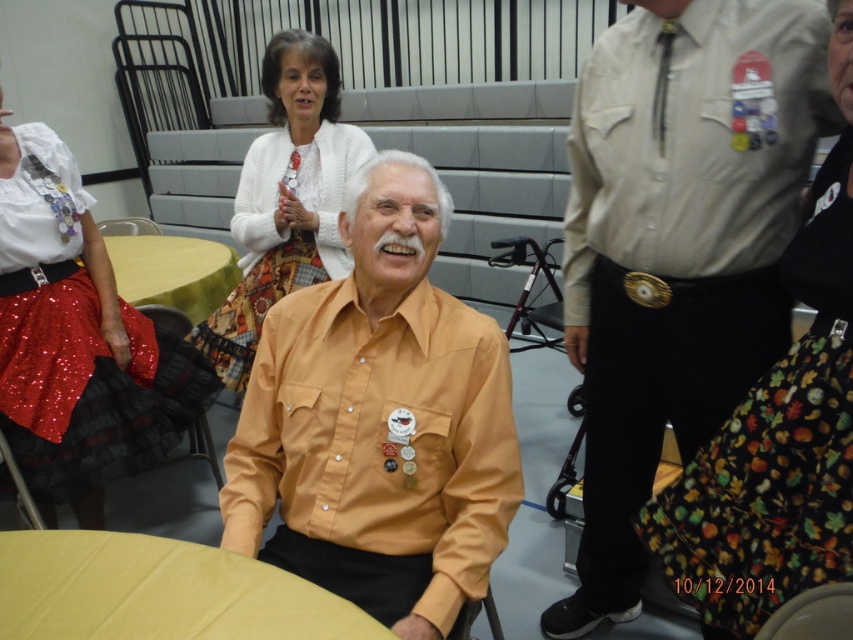
Question: Where is white knitted sweater at upper center located in relation to wooden chair at lower right in the image?

Choices:
 (A) above
 (B) below

Answer: (A)

Question: Which point is farther from the camera taking this photo?

Choices:
 (A) (119, 220)
 (B) (350, 449)

Answer: (A)

Question: Considering the relative positions of shiny sequined skirt at left and wooden chair at center in the image provided, where is shiny sequined skirt at left located with respect to wooden chair at center?

Choices:
 (A) below
 (B) above

Answer: (A)

Question: Which object is farther from the camera taking this photo?

Choices:
 (A) white knitted sweater at upper center
 (B) shiny sequined skirt at left

Answer: (A)

Question: Which object is farther from the camera taking this photo?

Choices:
 (A) beige cotton shirt at center
 (B) shiny sequined skirt at lower left

Answer: (B)

Question: Can you confirm if white knitted sweater at upper center is bigger than wooden chair at center?

Choices:
 (A) yes
 (B) no

Answer: (A)